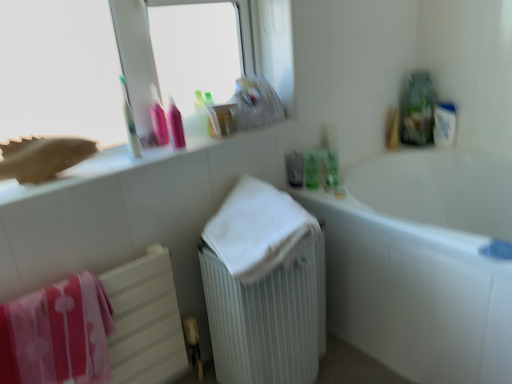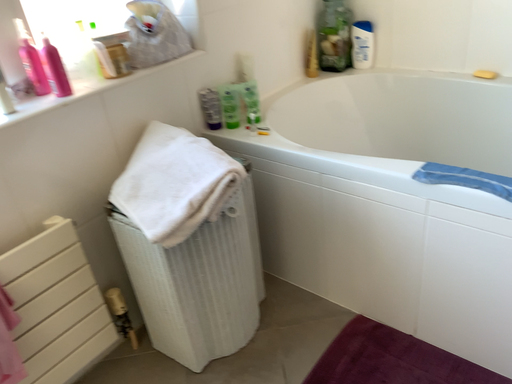
Question: How did the camera likely rotate when shooting the video?

Choices:
 (A) rotated left
 (B) rotated right

Answer: (B)